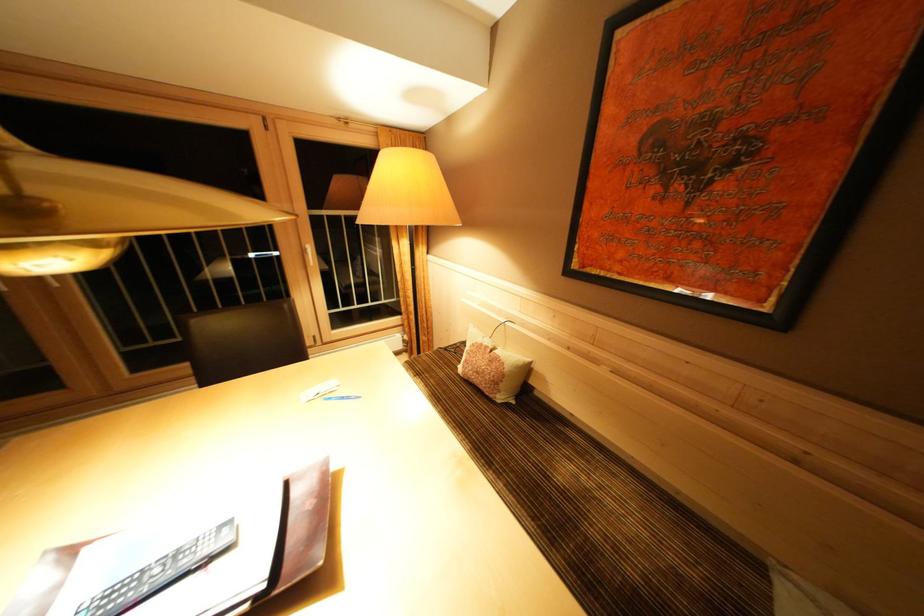
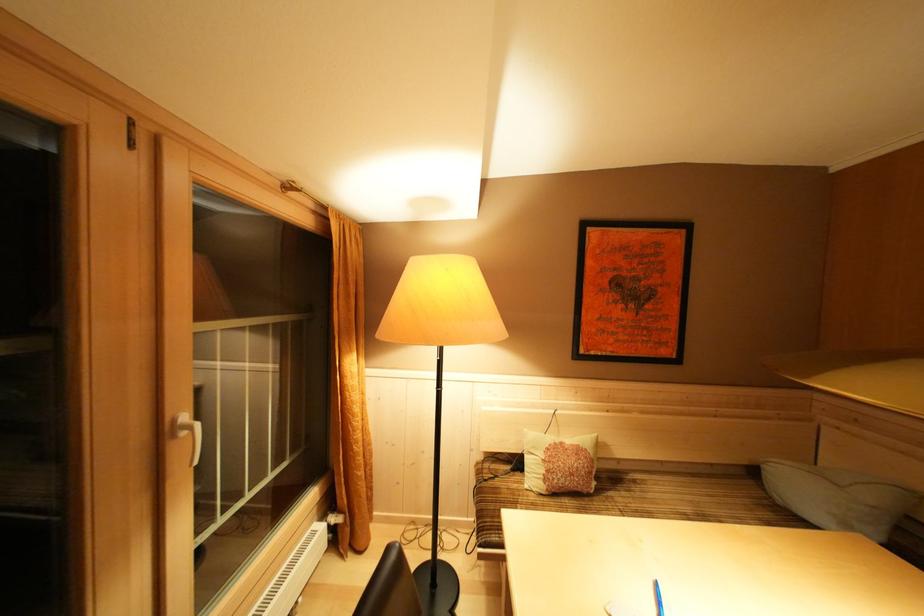
In the second image, find the point that corresponds to [493,352] in the first image.

(568, 448)